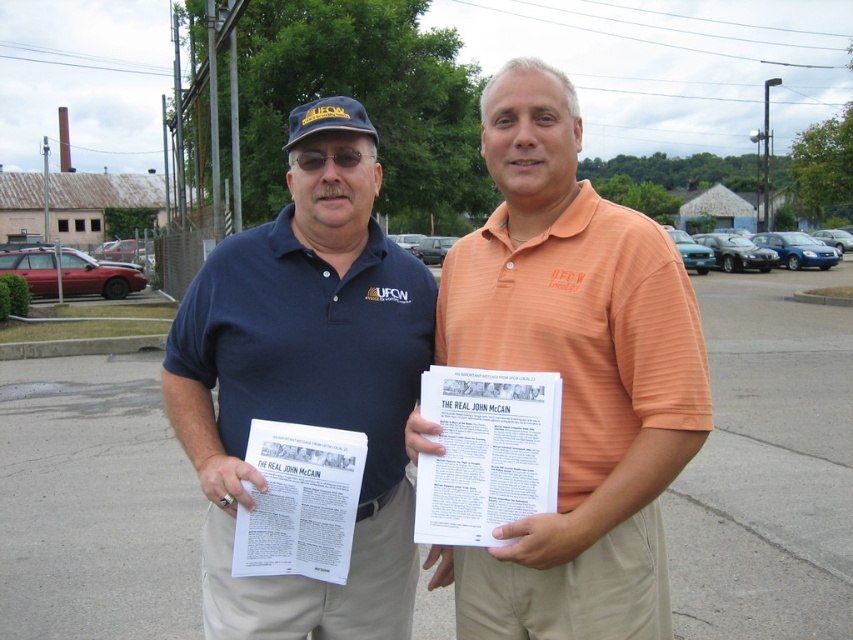
Question: In this image, where is orange striped polo shirt at center located relative to matte blue shirt at center?

Choices:
 (A) below
 (B) above

Answer: (A)

Question: Observing the image, what is the correct spatial positioning of orange striped polo shirt at center in reference to matte blue shirt at center?

Choices:
 (A) below
 (B) above

Answer: (A)

Question: Among these objects, which one is nearest to the camera?

Choices:
 (A) matte blue shirt at center
 (B) orange striped polo shirt at center

Answer: (B)

Question: Which of the following is the farthest from the observer?

Choices:
 (A) (274, 307)
 (B) (572, 317)

Answer: (A)

Question: Is orange striped polo shirt at center to the right of matte blue shirt at center from the viewer's perspective?

Choices:
 (A) yes
 (B) no

Answer: (A)